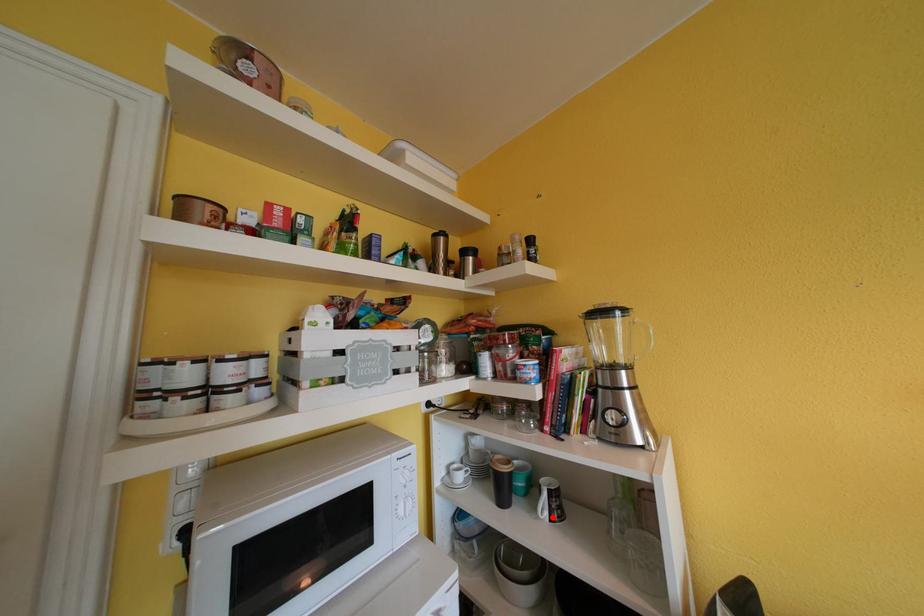
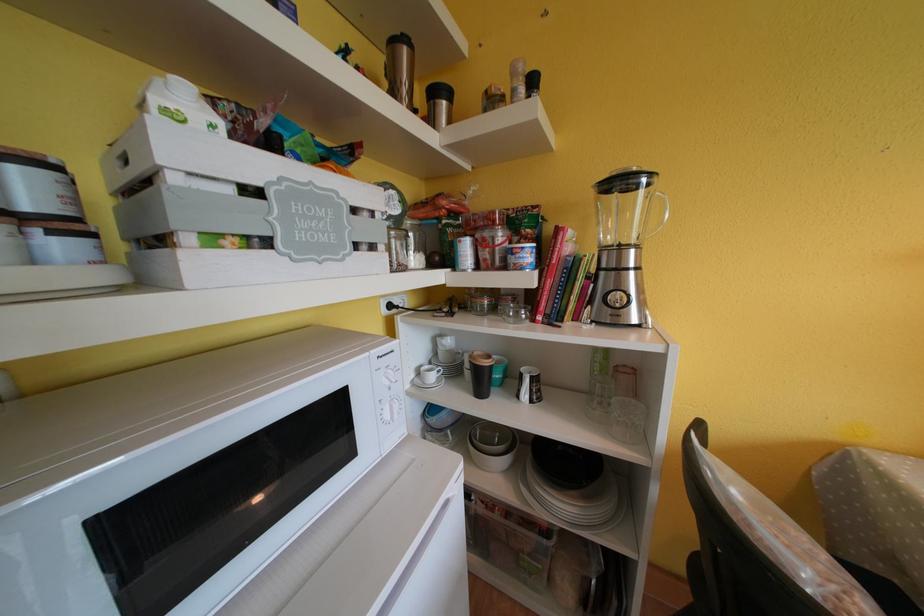
Locate, in the second image, the point that corresponds to the highlighted location in the first image.

(533, 400)